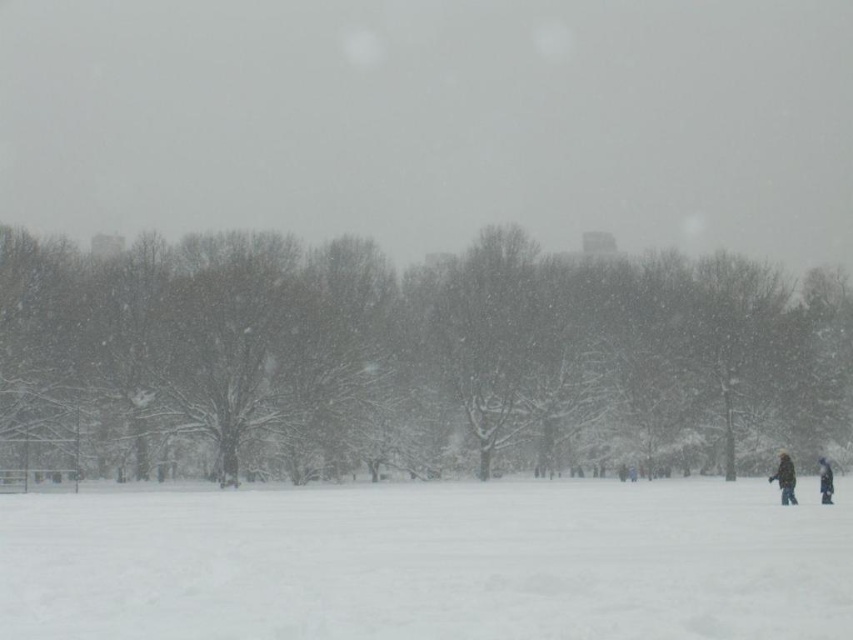
Question: Which point appears closest to the camera in this image?

Choices:
 (A) (772, 480)
 (B) (558, 512)

Answer: (B)

Question: Does white fluffy snow at lower center have a lesser width compared to brown fuzzy coat at lower right?

Choices:
 (A) yes
 (B) no

Answer: (B)

Question: Among these objects, which one is farthest from the camera?

Choices:
 (A) brown fuzzy coat at lower right
 (B) white fluffy snow at lower center
 (C) dark blue jacket at lower right

Answer: (C)

Question: Is brown fuzzy coat at lower right closer to camera compared to dark blue jacket at lower right?

Choices:
 (A) no
 (B) yes

Answer: (B)

Question: Observing the image, what is the correct spatial positioning of white fluffy snow at lower center in reference to dark blue jacket at lower right?

Choices:
 (A) right
 (B) left

Answer: (B)

Question: Estimate the real-world distances between objects in this image. Which object is farther from the dark blue jacket at lower right?

Choices:
 (A) brown fuzzy coat at lower right
 (B) white fluffy snow at lower center

Answer: (B)